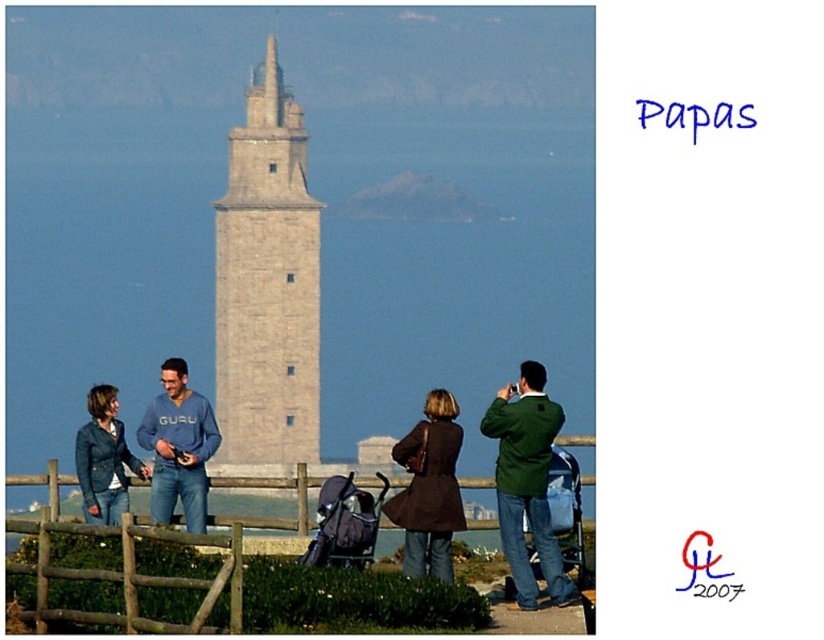
You are standing at the viewpoint and want to take a photo of the stone tower at center without the wooden at center blocking the view. Is it possible?

The stone tower at center is located above the wooden at center, so it is possible to take a photo of the stone tower at center without the wooden at center blocking the view by positioning yourself lower or angling the camera upwards.